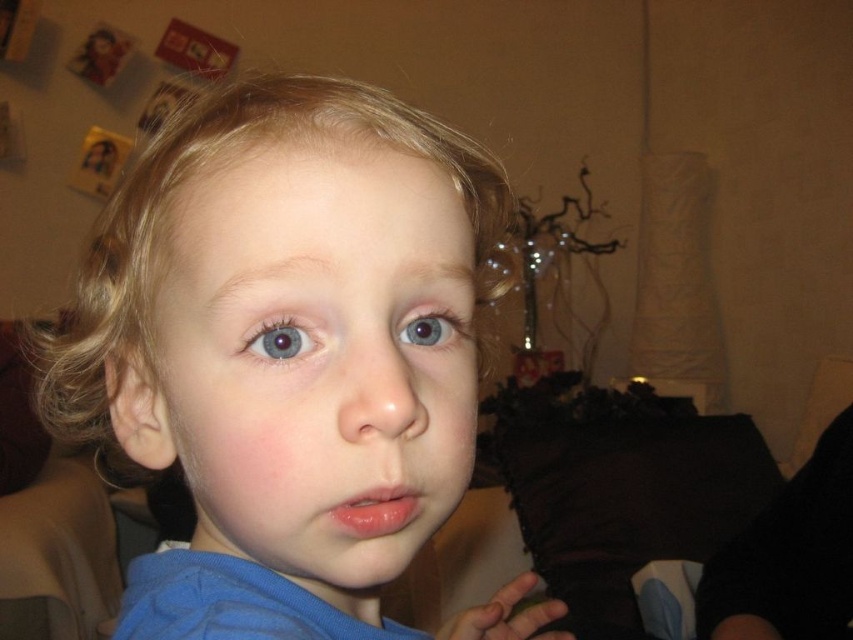
You are a photographer trying to focus on the child in the image. Since the blue fabric shirt at center and the smooth skin face at center are both at the center, which one is closer to the camera?

The blue fabric shirt at center is positioned over smooth skin face at center, so the blue fabric shirt at center is closer to the camera.

You are a photographer adjusting the focus on your camera. You want to capture both the blue matte eye at center and the blue glossy eye at center in sharp detail. Given that your camera can only focus on objects within a 1.5 inch range, will both eyes be in focus?

The blue matte eye at center is 1.57 inches away from the blue glossy eye at center. Since the distance between them exceeds the camera focus range of 1.5 inches, both eyes cannot be in focus simultaneously.

Looking at the child in the image, you notice two blue eyes. The blue matte eye at center and the blue glossy eye at center. Which of the child eyes has a smaller height?

The blue matte eye at center has a lesser height compared to the blue glossy eye at center.